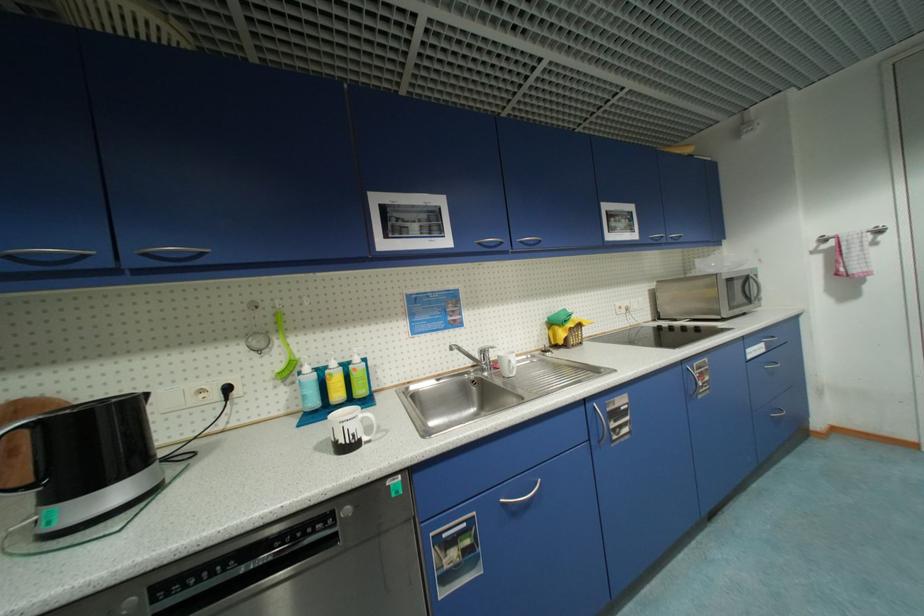
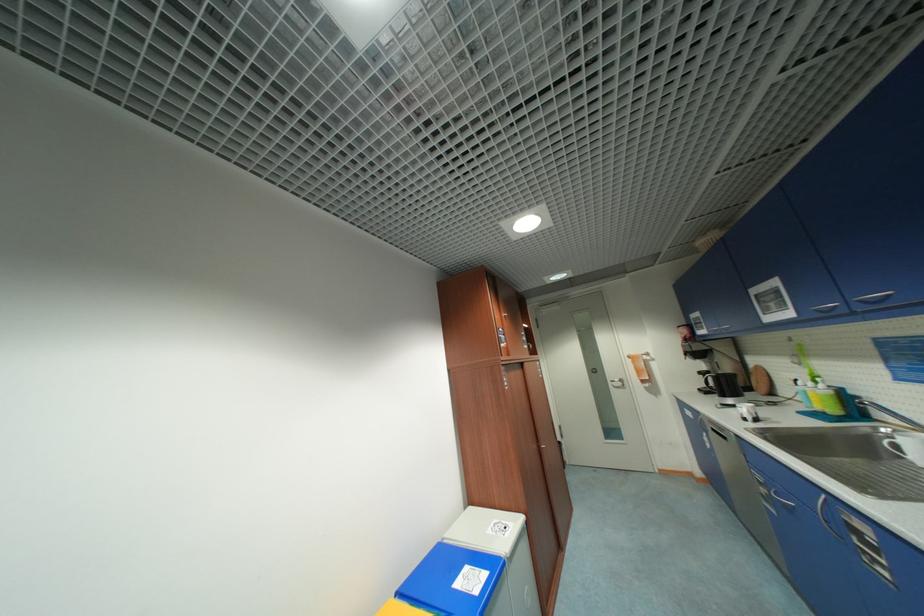
In the second image, find the point that corresponds to (x=485, y=245) in the first image.

(822, 312)